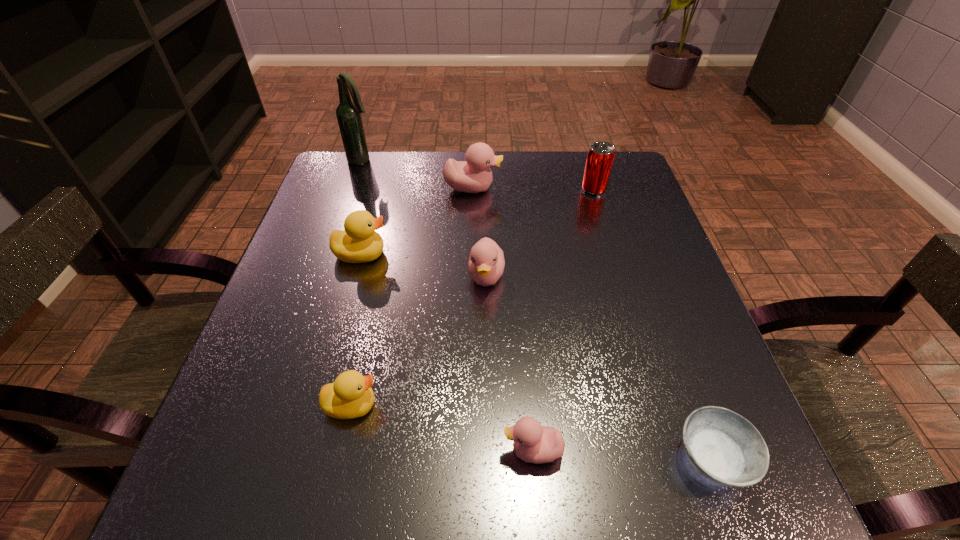
What are the coordinates of `free region located 0.110m on the front-facing side of the nearest duckling` in the screenshot? It's located at (430, 451).

Where is `free location located 0.350m on the back of the shortest object`? Image resolution: width=960 pixels, height=540 pixels. free location located 0.350m on the back of the shortest object is located at coordinates (642, 266).

Locate an element on the screen. beer bottle at the far edge is located at coordinates (348, 113).

Locate an element on the screen. duckling located at the far edge is located at coordinates (474, 175).

Image resolution: width=960 pixels, height=540 pixels. In order to click on soda can at the far edge in this screenshot , I will do `click(600, 157)`.

Locate an element on the screen. The width and height of the screenshot is (960, 540). duckling that is at the near edge is located at coordinates (533, 443).

You are a GUI agent. You are given a task and a screenshot of the screen. Output one action in this format:
    pyautogui.click(x=<x>, y=<y>)
    Task: Click on the ashtray that is at the near edge
    The height and width of the screenshot is (540, 960).
    Given the screenshot: What is the action you would take?
    pyautogui.click(x=724, y=447)

In order to click on beer bottle situated at the left edge in this screenshot , I will do `click(348, 113)`.

What are the coordinates of `soda can situated at the right edge` in the screenshot? It's located at (600, 157).

Where is `ashtray that is positioned at the right edge`? This screenshot has width=960, height=540. ashtray that is positioned at the right edge is located at coordinates (724, 447).